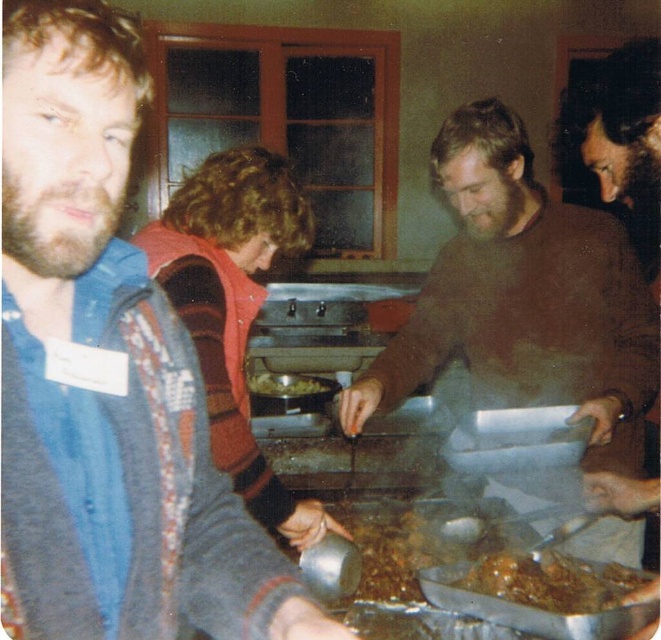
Does brown matte sweater at center have a greater height compared to shiny silver tray at center?

Indeed, brown matte sweater at center has a greater height compared to shiny silver tray at center.

Is brown matte sweater at center to the right of shiny silver tray at center from the viewer's perspective?

Yes, brown matte sweater at center is to the right of shiny silver tray at center.

Does point (607, 429) lie behind point (299, 384)?

No.

The height and width of the screenshot is (640, 661). Find the location of `brown matte sweater at center`. brown matte sweater at center is located at coordinates (524, 298).

Can you confirm if brown wool sweater at center is positioned to the right of brown matte sweater at center?

No, brown wool sweater at center is not to the right of brown matte sweater at center.

Can you confirm if brown wool sweater at center is thinner than brown matte sweater at center?

Yes, brown wool sweater at center is thinner than brown matte sweater at center.

Is point (28, 209) closer to camera compared to point (446, 179)?

Yes, it is.

Where is `brown wool sweater at center`? brown wool sweater at center is located at coordinates (106, 376).

Between brown wool sweater at center and brown fuzzy sweater at center, which one is positioned higher?

Positioned higher is brown fuzzy sweater at center.

Is brown wool sweater at center above brown fuzzy sweater at center?

No, brown wool sweater at center is not above brown fuzzy sweater at center.

Does point (13, 416) come closer to viewer compared to point (603, 161)?

Yes.

Where is `brown wool sweater at center`? The image size is (661, 640). brown wool sweater at center is located at coordinates (106, 376).